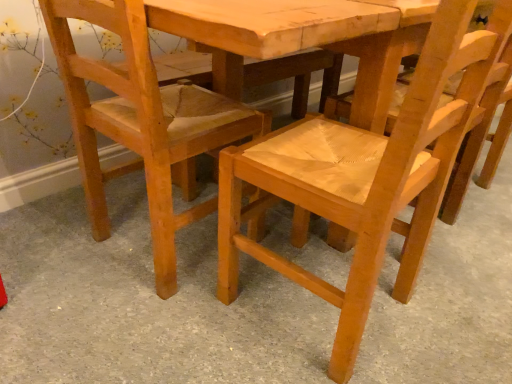
In order to click on free space to the left of natural wood chair at center, the first chair from the right in this screenshot , I will do `click(179, 332)`.